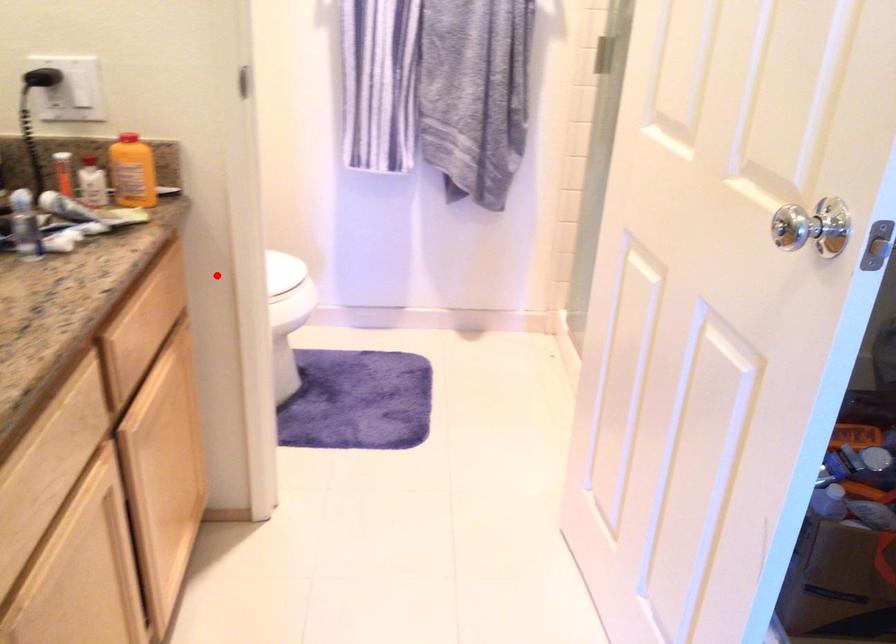
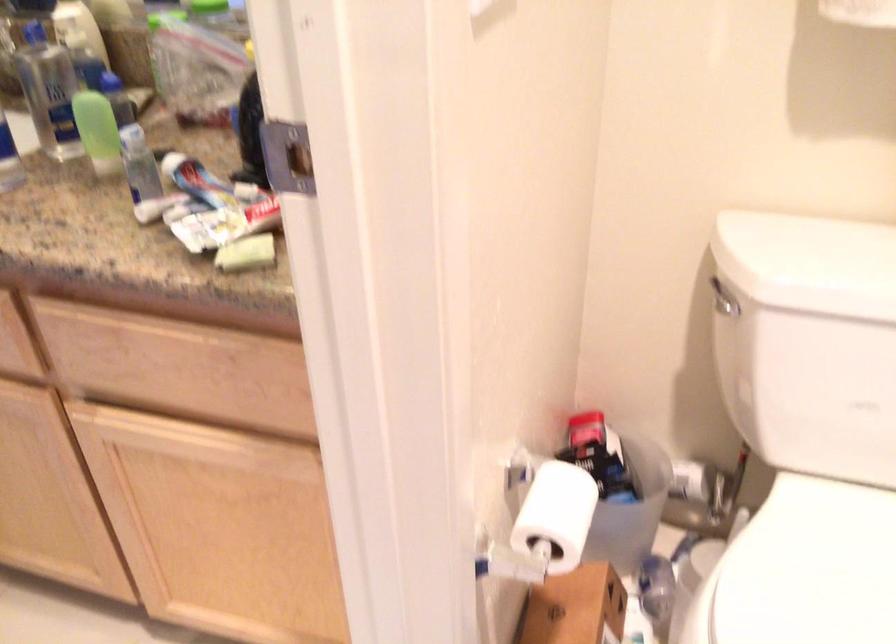
Question: I am providing you with two images of the same scene from different viewpoints. A red point is shown in image1. For the corresponding object point in image2, is it positioned nearer or farther from the camera?

Choices:
 (A) Nearer
 (B) Farther

Answer: (A)